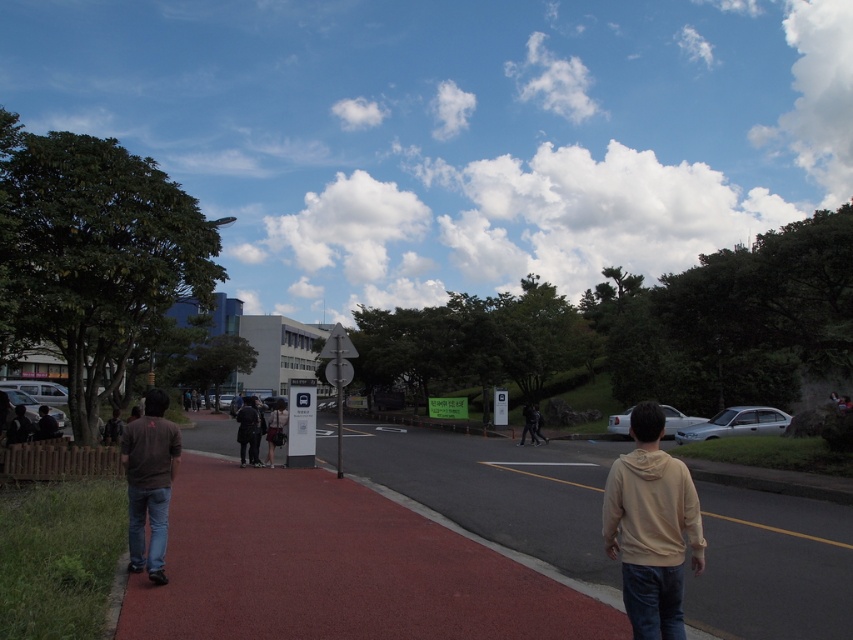
You are a photographer standing on the red paved pathway. You want to take a photo of the beige hoodie at center and the dark brown shirt at left. Which of the two has a wider appearance in the photo?

The beige hoodie at center has a wider appearance in the photo because its width surpasses that of the dark brown shirt at left.

You are standing at point (498, 488) in the scene. What is the material of the surface you are standing on?

The surface at point (498, 488) is red rubber pavement.

You are standing at the bus stop sign on the left side of the path. You see the red rubber pavement at center and the beige hoodie at center. Which object is closer to you?

The beige hoodie at center is closer to you since the red rubber pavement at center is 10.23 meters away from it, meaning the beige hoodie is nearer than the pavement.